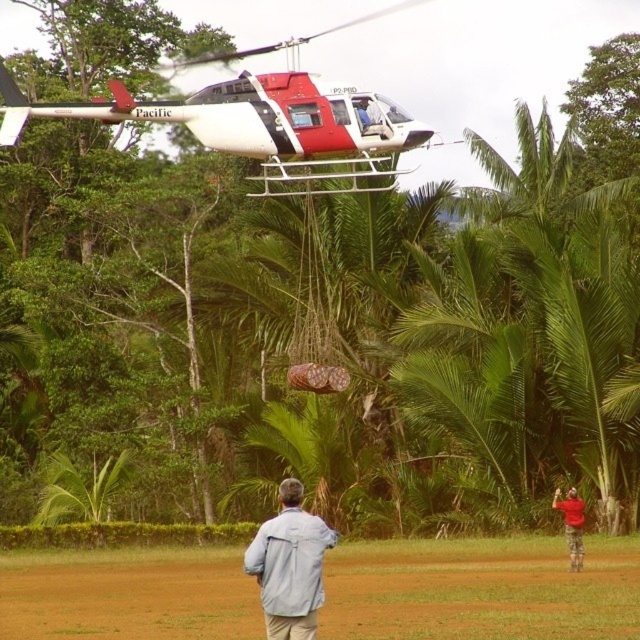
Can you confirm if brown dirt field at lower center is wider than red and white helicopter at upper center?

In fact, brown dirt field at lower center might be narrower than red and white helicopter at upper center.

Does brown dirt field at lower center appear over red and white helicopter at upper center?

Actually, brown dirt field at lower center is below red and white helicopter at upper center.

What do you see at coordinates (481, 589) in the screenshot?
I see `brown dirt field at lower center` at bounding box center [481, 589].

Where is `brown dirt field at lower center`? The height and width of the screenshot is (640, 640). brown dirt field at lower center is located at coordinates (481, 589).

In the scene shown: Does brown dirt field at lower center have a greater width compared to red cotton shirt at lower right?

Yes.

Can you confirm if brown dirt field at lower center is positioned below red cotton shirt at lower right?

Correct, brown dirt field at lower center is located below red cotton shirt at lower right.

Where is `brown dirt field at lower center`? brown dirt field at lower center is located at coordinates (481, 589).

The height and width of the screenshot is (640, 640). In order to click on brown dirt field at lower center in this screenshot , I will do `click(481, 589)`.

Is point (524, 621) closer to camera compared to point (316, 589)?

That is False.

Identify the location of brown dirt field at lower center. (481, 589).